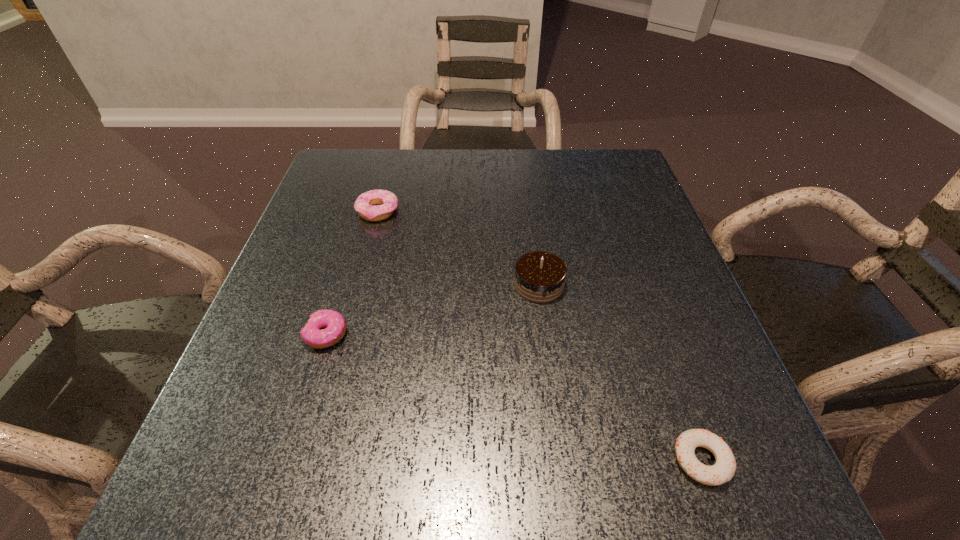
Where is `the third object from left to right`? The width and height of the screenshot is (960, 540). the third object from left to right is located at coordinates (540, 276).

What are the coordinates of `chocolate cake` in the screenshot? It's located at (540, 276).

The image size is (960, 540). What are the coordinates of `the farthest doughnut` in the screenshot? It's located at (386, 202).

Identify the location of the second nearest doughnut. (312, 335).

This screenshot has height=540, width=960. I want to click on the shortest doughnut, so click(x=723, y=470).

Identify the location of the nearest object. (723, 470).

The width and height of the screenshot is (960, 540). What are the coordinates of `blank area located on the left of the second farthest object` in the screenshot? It's located at (470, 285).

The width and height of the screenshot is (960, 540). Identify the location of free spot located 0.320m on the right of the farthest doughnut. (531, 212).

The width and height of the screenshot is (960, 540). Find the location of `free space located 0.320m on the back of the third farthest object`. free space located 0.320m on the back of the third farthest object is located at coordinates (363, 215).

You are a GUI agent. You are given a task and a screenshot of the screen. Output one action in this format:
    pyautogui.click(x=<x>, y=<y>)
    Task: Click on the free space located 0.130m on the left of the nearest doughnut
    
    Given the screenshot: What is the action you would take?
    pyautogui.click(x=585, y=460)